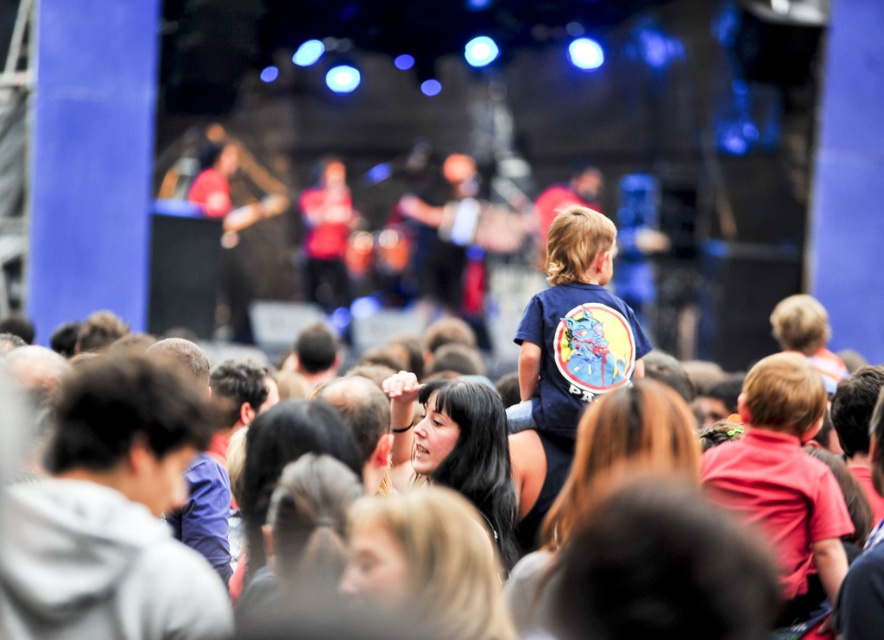
Between gray hoodie at left and navy blue t-shirt at center, which one is positioned lower?

Positioned lower is gray hoodie at left.

Does gray hoodie at left have a smaller size compared to navy blue t-shirt at center?

No, gray hoodie at left is not smaller than navy blue t-shirt at center.

Locate an element on the screen. gray hoodie at left is located at coordinates (110, 515).

Is point (813, 490) less distant than point (367, 413)?

Yes, point (813, 490) is closer to viewer.

Where is `red matte shirt at center`? The image size is (884, 640). red matte shirt at center is located at coordinates (783, 477).

You are a GUI agent. You are given a task and a screenshot of the screen. Output one action in this format:
    pyautogui.click(x=<x>, y=<y>)
    Task: Click on the red matte shirt at center
    The image size is (884, 640).
    Given the screenshot: What is the action you would take?
    pyautogui.click(x=783, y=477)

The image size is (884, 640). Find the location of `red matte shirt at center`. red matte shirt at center is located at coordinates (783, 477).

Between navy blue t-shirt at center and dark brown hair at center, which one is positioned lower?

Positioned lower is dark brown hair at center.

Between navy blue t-shirt at center and dark brown hair at center, which one appears on the left side from the viewer's perspective?

dark brown hair at center

Which is in front, point (580, 294) or point (383, 477)?

Positioned in front is point (383, 477).

Locate an element on the screen. This screenshot has width=884, height=640. navy blue t-shirt at center is located at coordinates (573, 330).